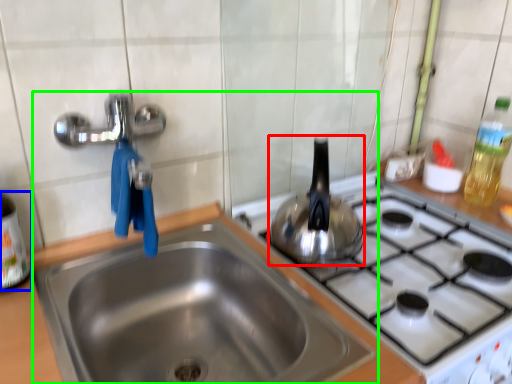
Question: Considering the real-world distances, which object is farthest from tea pot (highlighted by a red box)? bottle (highlighted by a blue box) or sink (highlighted by a green box)?

Choices:
 (A) bottle
 (B) sink

Answer: (A)